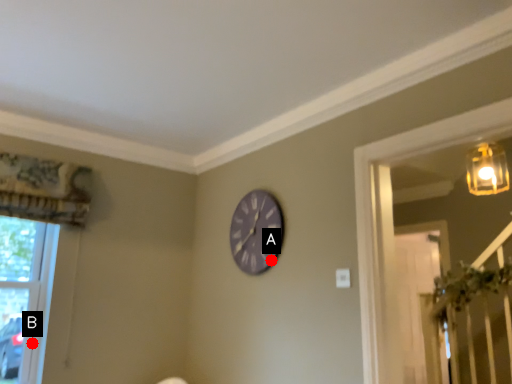
Question: Two points are circled on the image, labeled by A and B beside each circle. Which point appears farthest from the camera in this image?

Choices:
 (A) A is further
 (B) B is further

Answer: (B)